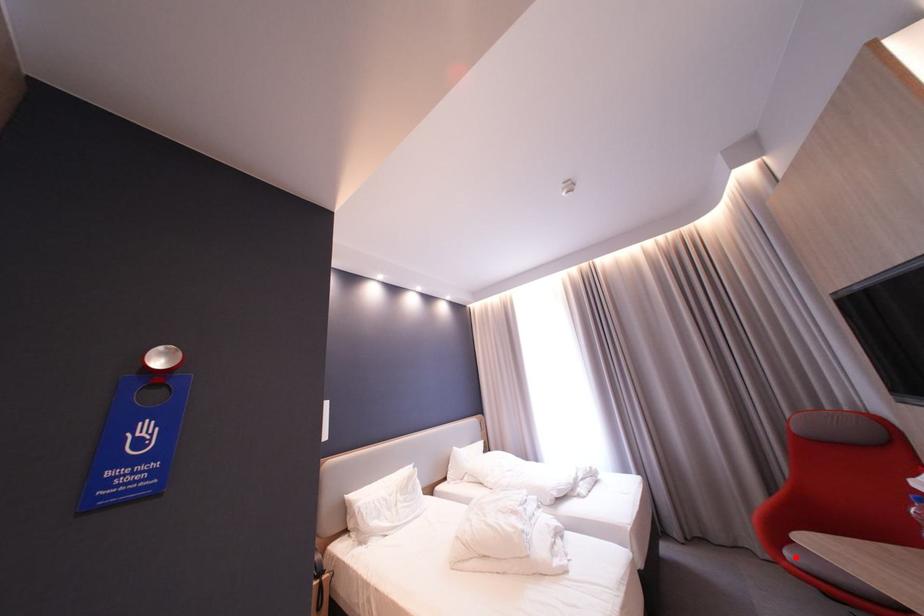
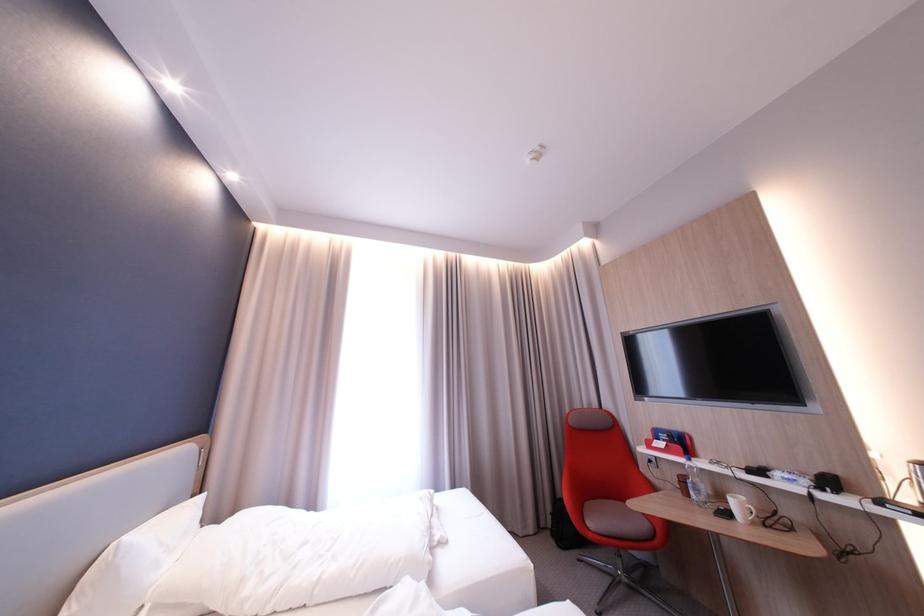
Where in the second image is the point corresponding to the highlighted location from the first image?

(600, 529)